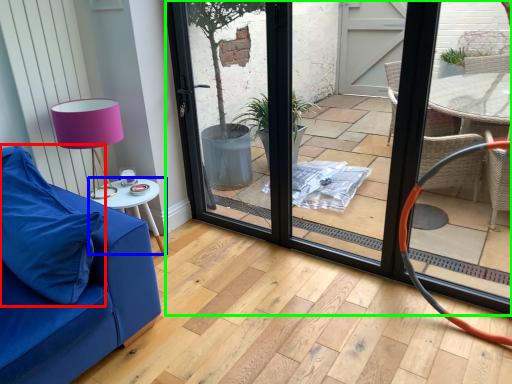
Question: Considering the real-world distances, which object is farthest from pillow (highlighted by a red box)? table (highlighted by a blue box) or door (highlighted by a green box)?

Choices:
 (A) table
 (B) door

Answer: (B)